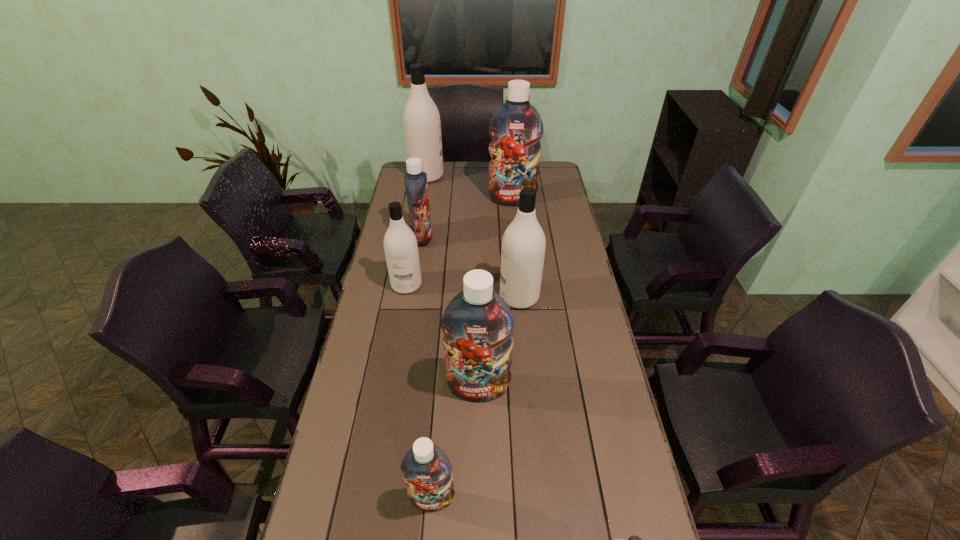
This screenshot has width=960, height=540. I want to click on free area in between the farthest object and the second farthest object, so click(469, 187).

The width and height of the screenshot is (960, 540). What are the coordinates of `vacant area between the farthest object and the biggest blue shampoo` in the screenshot? It's located at (469, 187).

You are a GUI agent. You are given a task and a screenshot of the screen. Output one action in this format:
    pyautogui.click(x=<x>, y=<y>)
    Task: Click on the free space between the biggest white shampoo and the third nearest object
    
    Given the screenshot: What is the action you would take?
    pyautogui.click(x=452, y=281)

The width and height of the screenshot is (960, 540). What are the coordinates of `object that is the third closest to the rightmost white shampoo` in the screenshot? It's located at (523, 245).

I want to click on object that is the closest to the nearest white shampoo, so click(x=426, y=469).

At what (x,y) coordinates should I click in order to perform the action: click on the sixth closest shampoo to the third smallest white shampoo. Please return your answer as a coordinate pair (x, y). The height and width of the screenshot is (540, 960). Looking at the image, I should click on pos(421,119).

Choose which shampoo is the fourth nearest neighbor to the farthest blue shampoo. Please provide its 2D coordinates. Your answer should be formatted as a tuple, i.e. [(x, y)], where the tuple contains the x and y coordinates of a point satisfying the conditions above.

[(400, 244)]

Point out which white shampoo is positioned as the fourth nearest to the sixth farthest object. Please provide its 2D coordinates. Your answer should be formatted as a tuple, i.e. [(x, y)], where the tuple contains the x and y coordinates of a point satisfying the conditions above.

[(421, 119)]

Choose which white shampoo is the third nearest neighbor to the nearest blue shampoo. Please provide its 2D coordinates. Your answer should be formatted as a tuple, i.e. [(x, y)], where the tuple contains the x and y coordinates of a point satisfying the conditions above.

[(400, 244)]

Select which blue shampoo is the third closest to the nearest object. Please provide its 2D coordinates. Your answer should be formatted as a tuple, i.e. [(x, y)], where the tuple contains the x and y coordinates of a point satisfying the conditions above.

[(416, 186)]